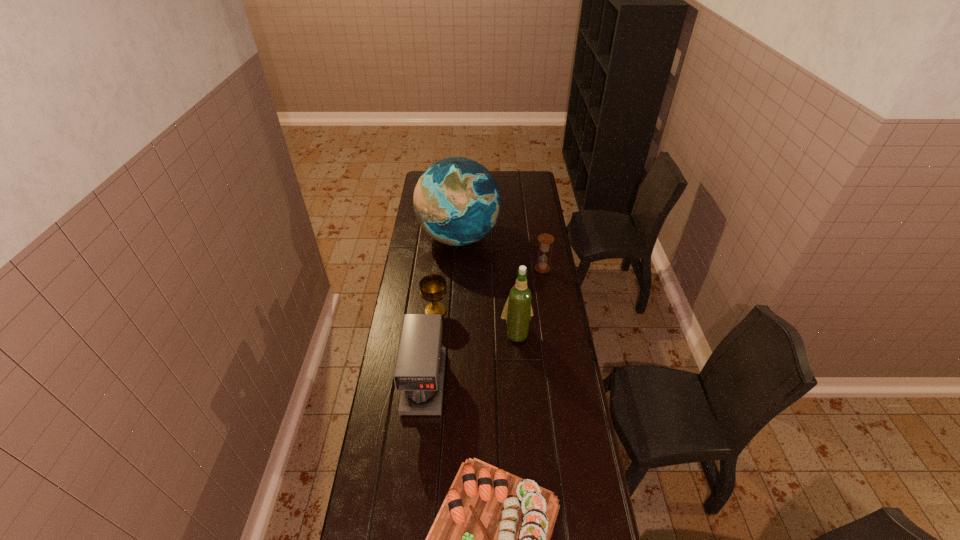
The width and height of the screenshot is (960, 540). I want to click on free space between the rightmost object and the chalice, so click(489, 290).

You are a GUI agent. You are given a task and a screenshot of the screen. Output one action in this format:
    pyautogui.click(x=<x>, y=<y>)
    Task: Click on the free space that is in between the globe and the hourglass
    The image size is (960, 540).
    Given the screenshot: What is the action you would take?
    pyautogui.click(x=500, y=253)

This screenshot has height=540, width=960. I want to click on free area in between the chalice and the rightmost object, so click(x=489, y=290).

Where is `vacant space that's between the fourth shortest object and the hourglass`? The width and height of the screenshot is (960, 540). vacant space that's between the fourth shortest object and the hourglass is located at coordinates (483, 326).

I want to click on the third closest object to the globe, so click(517, 311).

Choose which object is the nearest neighbor to the fourth shortest object. Please provide its 2D coordinates. Your answer should be formatted as a tuple, i.e. [(x, y)], where the tuple contains the x and y coordinates of a point satisfying the conditions above.

[(491, 537)]